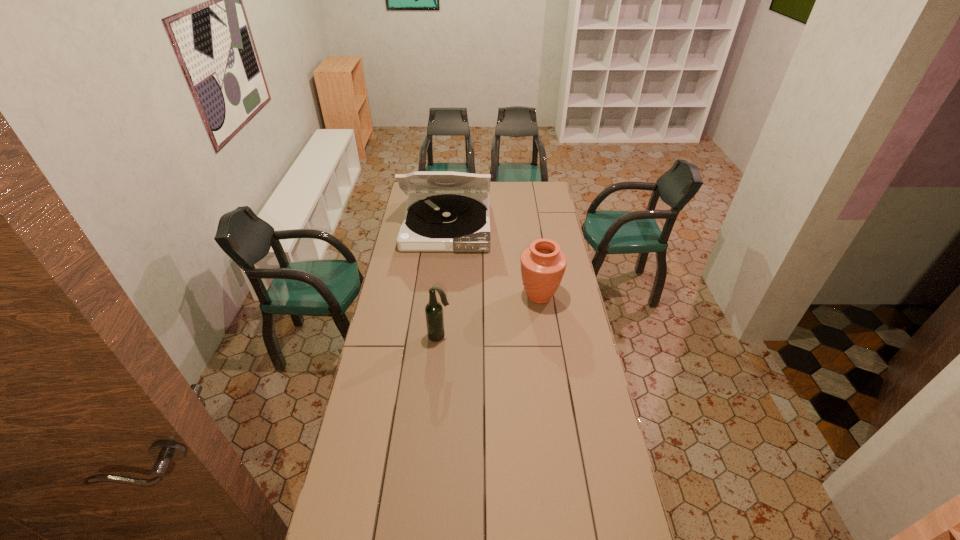
I want to click on the farthest object, so click(446, 211).

At what (x,y) coordinates should I click in order to perform the action: click on the tallest object. Please return your answer as a coordinate pair (x, y). The width and height of the screenshot is (960, 540). Looking at the image, I should click on (446, 211).

I want to click on vase, so click(x=543, y=265).

Locate an element on the screen. Image resolution: width=960 pixels, height=540 pixels. the second farthest object is located at coordinates (543, 265).

Identify the location of the nearest object. (434, 312).

Where is `free region located 0.310m on the control panel of the tallest object`? This screenshot has width=960, height=540. free region located 0.310m on the control panel of the tallest object is located at coordinates (440, 294).

I want to click on free region located 0.050m on the back of the vase, so click(537, 275).

This screenshot has width=960, height=540. I want to click on vacant space located on the back of the nearest object, so click(444, 290).

At what (x,y) coordinates should I click in order to perform the action: click on object that is at the left edge. Please return your answer as a coordinate pair (x, y). The height and width of the screenshot is (540, 960). Looking at the image, I should click on (446, 211).

Find the location of a particular element. The height and width of the screenshot is (540, 960). object positioned at the right edge is located at coordinates (543, 265).